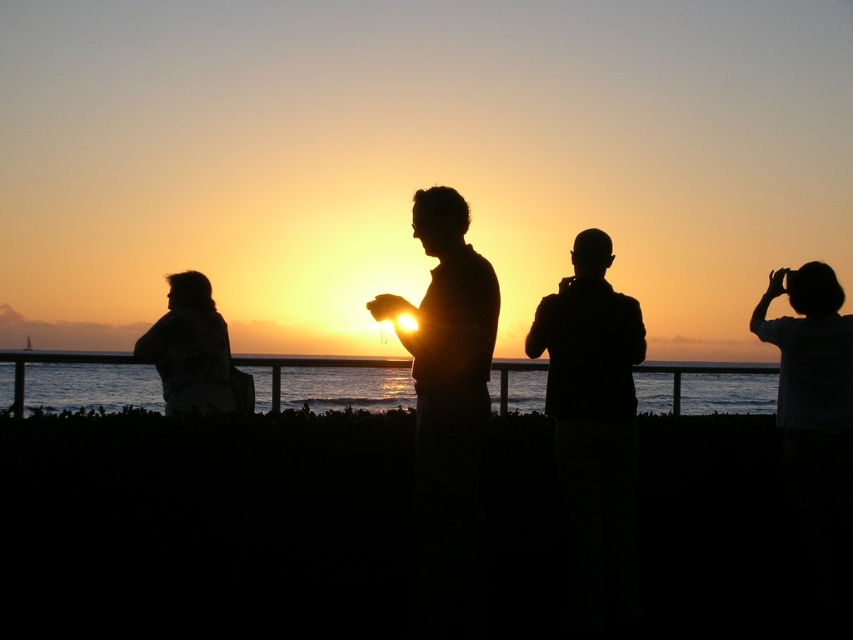
Does transparent water at center have a lesser height compared to white matte shirt at right?

Correct, transparent water at center is not as tall as white matte shirt at right.

You are a GUI agent. You are given a task and a screenshot of the screen. Output one action in this format:
    pyautogui.click(x=<x>, y=<y>)
    Task: Click on the transparent water at center
    
    Given the screenshot: What is the action you would take?
    pyautogui.click(x=90, y=385)

Locate an element on the screen. transparent water at center is located at coordinates (90, 385).

Where is `transparent water at center`? The height and width of the screenshot is (640, 853). transparent water at center is located at coordinates (90, 385).

This screenshot has height=640, width=853. What do you see at coordinates (90, 385) in the screenshot?
I see `transparent water at center` at bounding box center [90, 385].

Does transparent water at center have a smaller size compared to silhouette figure at center?

Correct, transparent water at center occupies less space than silhouette figure at center.

The height and width of the screenshot is (640, 853). Describe the element at coordinates (90, 385) in the screenshot. I see `transparent water at center` at that location.

Find the location of a particular element. This screenshot has width=853, height=640. transparent water at center is located at coordinates (90, 385).

Does point (544, 401) come in front of point (212, 326)?

Yes, point (544, 401) is in front of point (212, 326).

Which is behind, point (583, 280) or point (210, 310)?

Point (210, 310)

You are a GUI agent. You are given a task and a screenshot of the screen. Output one action in this format:
    pyautogui.click(x=<x>, y=<y>)
    Task: Click on the black matte person at center
    
    Given the screenshot: What is the action you would take?
    pyautogui.click(x=589, y=339)